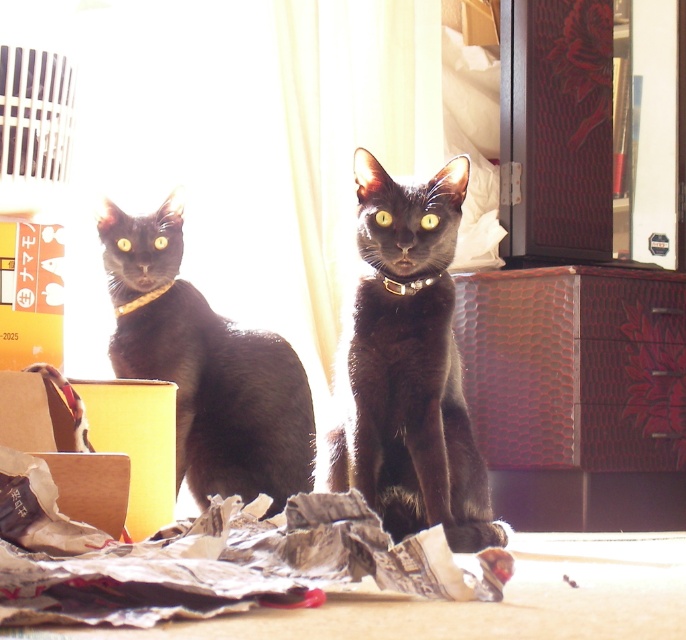
Can you confirm if yellow cardboard box at lower left is positioned to the right of metallic gold neckband at left?

Indeed, yellow cardboard box at lower left is positioned on the right side of metallic gold neckband at left.

Does point (132, 497) lie in front of point (147, 301)?

Yes, point (132, 497) is in front of point (147, 301).

Where is `yellow cardboard box at lower left`? Image resolution: width=686 pixels, height=640 pixels. yellow cardboard box at lower left is located at coordinates (137, 442).

Is point (73, 467) positioned in front of point (147, 292)?

Yes, point (73, 467) is closer to viewer.

Is cardboard box at lower left smaller than metallic gold neckband at left?

Actually, cardboard box at lower left might be larger than metallic gold neckband at left.

Image resolution: width=686 pixels, height=640 pixels. What are the coordinates of `cardboard box at lower left` in the screenshot? It's located at (62, 445).

Can you confirm if orange cardboard box at left is positioned to the left of metallic gold neckband at left?

Indeed, orange cardboard box at left is positioned on the left side of metallic gold neckband at left.

Measure the distance between point [12,310] and camera.

The distance of point [12,310] from camera is 7.30 feet.

Image resolution: width=686 pixels, height=640 pixels. In order to click on orange cardboard box at left in this screenshot , I will do `click(29, 294)`.